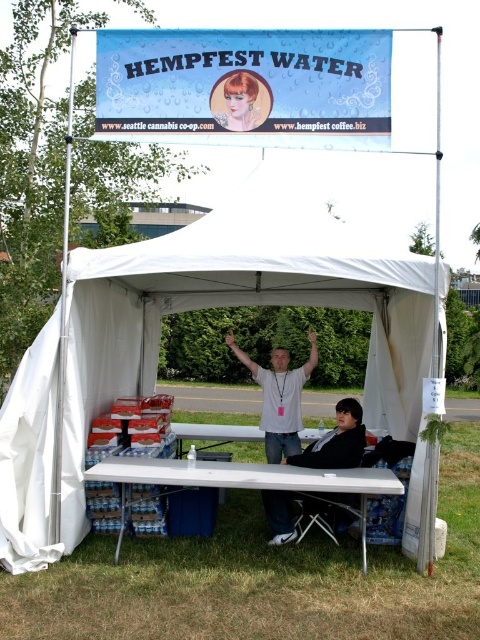
You are standing outside the tent and want to retrieve your black fabric jacket from inside. The tent entrance is 2 meters wide. Can you walk straight to the black fabric jacket at lower center without bending down?

The black fabric jacket at lower center and viewer are 5.50 meters apart from each other. Since the tent entrance is 2 meters wide, you can walk straight to the jacket as the distance is sufficient, but you may need to check the height of the tent to ensure you don